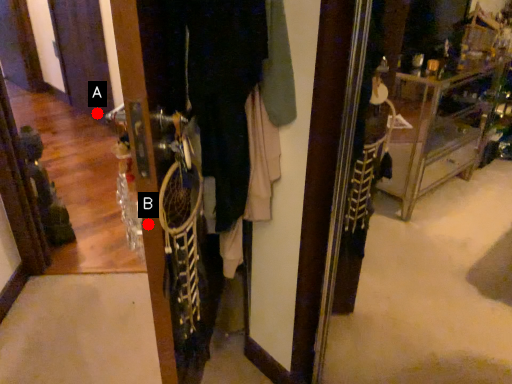
Question: Two points are circled on the image, labeled by A and B beside each circle. Among these points, which one is farthest from the camera?

Choices:
 (A) A is further
 (B) B is further

Answer: (A)